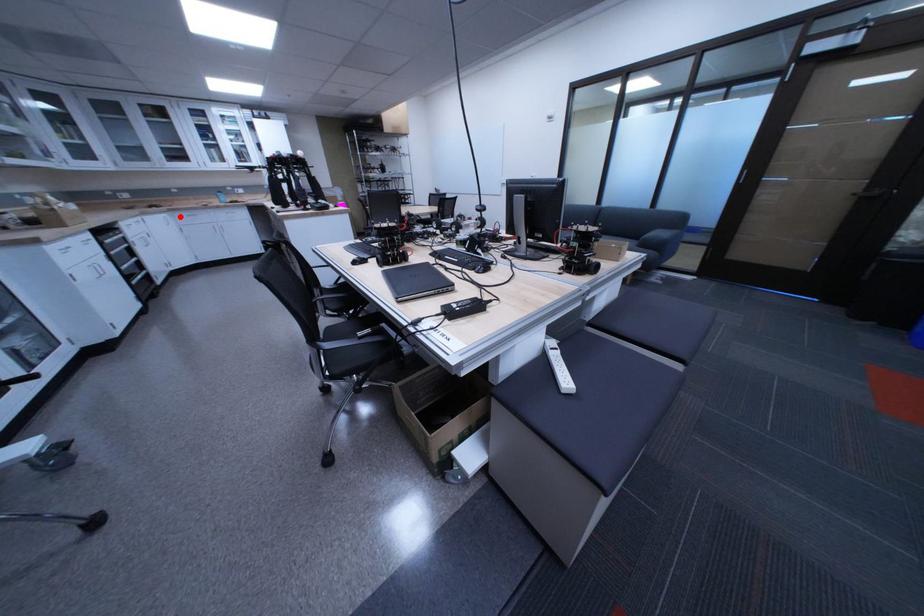
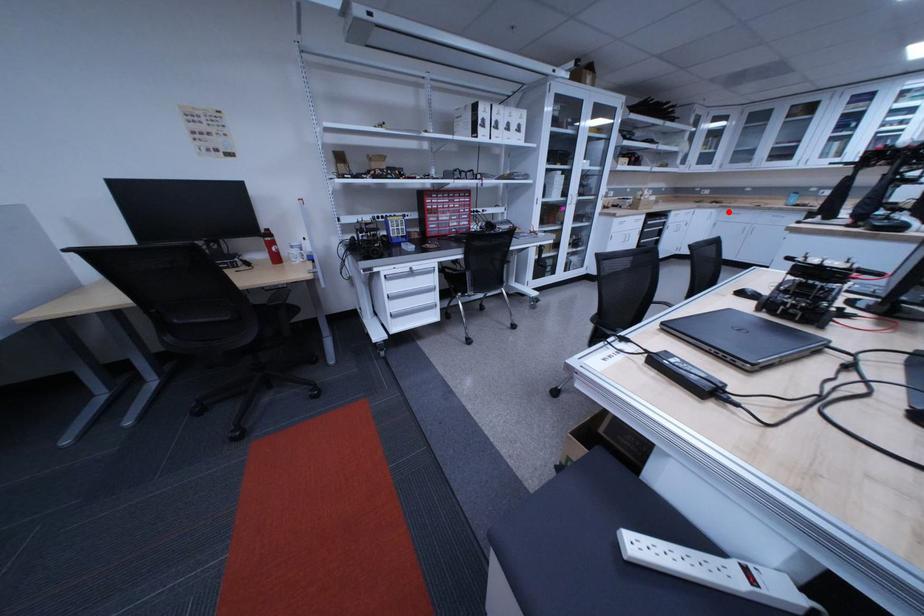
I am providing you with two images of the same scene from different viewpoints. A red point is marked on the first image and another point is marked on the second image. Is the marked point in image1 the same physical position as the marked point in image2?

Yes